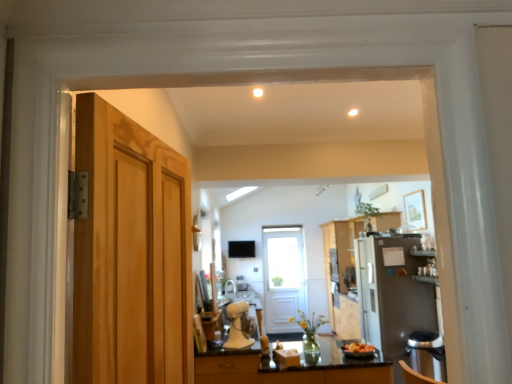
Question: In the image, is white wooden door at center, which is counted as the 2th door, starting from the left, positioned in front of or behind wooden cabinet at center?

Choices:
 (A) behind
 (B) front

Answer: (A)

Question: From the image's perspective, is white wooden door at center, which is counted as the 2th door, starting from the left, located above or below wooden cabinet at center?

Choices:
 (A) below
 (B) above

Answer: (A)

Question: Which of these objects is positioned farthest from the black marble countertop at lower center?

Choices:
 (A) black plastic dishwasher at lower right
 (B) multicolored plastic bowl at center
 (C) white wooden door at center, which is counted as the 2th door, starting from the left
 (D) satin silver refrigerator at right, which is counted as the second appliance, starting from the left
 (E) wooden cabinet at center

Answer: (C)

Question: Considering the real-world distances, which object is closest to the white matte stand mixer at center, the first appliance from the left?

Choices:
 (A) multicolored plastic bowl at center
 (B) satin silver refrigerator at right, placed as the first appliance when sorted from back to front
 (C) white wooden door at center, marked as the second door in a top-to-bottom arrangement
 (D) light brown wood door at left, arranged as the second door when ordered from the bottom
 (E) black plastic dishwasher at lower right

Answer: (A)